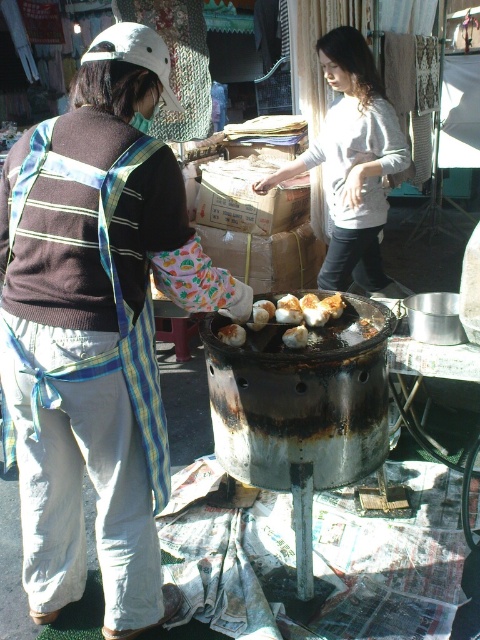
You are a food vendor who wants to place a new order of buns on the rusty metal grill at center. However, you notice the light gray sweater at center is currently on the grill. Can you place the buns directly on the grill without moving the sweater?

The rusty metal grill at center has a lesser height compared to the light gray sweater at center, meaning the sweater is taller than the grill. Therefore, the sweater is likely placed on top of the grill, blocking access to the cooking surface. To place the buns, you would need to move the sweater first.

You are a food vendor who needs to place a new order of brown matte eggs at center on the stand. The stand has a maximum load capacity of 5 feet. Can you safely place the brown matte egg at center near the light gray sweater at center without exceeding the stand capacity?

The distance between the light gray sweater at center and the brown matte egg at center is 5.13 feet, which exceeds the stand maximum load capacity of 5 feet. Therefore, placing the brown matte egg at center near the light gray sweater at center would exceed the stand capacity.